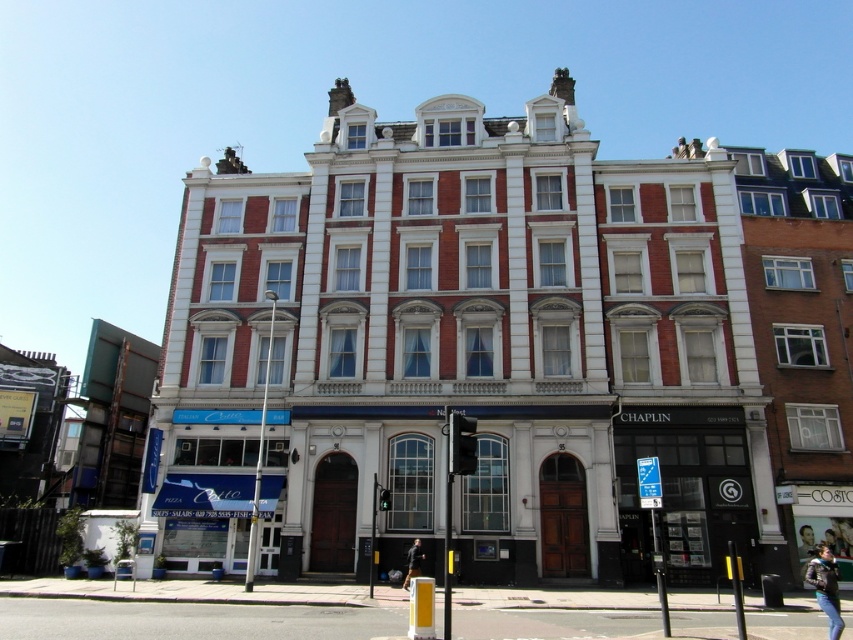
You are a delivery person standing at the entrance of the building. You need to place a package on the ground near the black leather jacket at lower center. Where should you place it?

The black leather jacket at lower center is located at point (413, 561), so you should place the package near that coordinate.

You are a customer entering the building and see both the leather jacket at lower right and the black leather jacket at lower center near the entrance. Which jacket is taller?

The leather jacket at lower right is much taller than the black leather jacket at lower center.

You are a delivery person standing at the entrance of the building and see the black leather jacket at lower center and the smooth skin face at center. Which object is closer to you?

The black leather jacket at lower center is closer to you than the smooth skin face at center because they are 18.74 meters apart from each other.